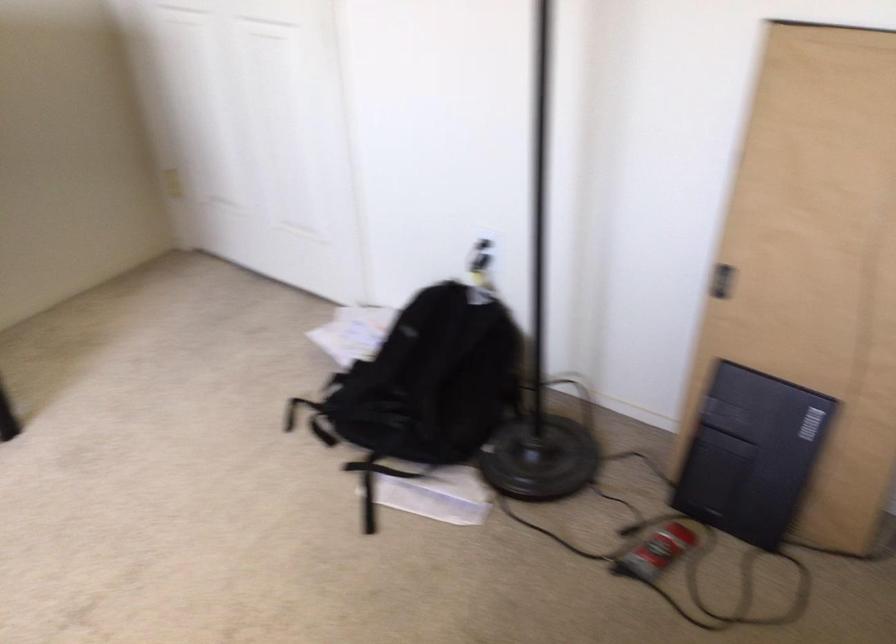
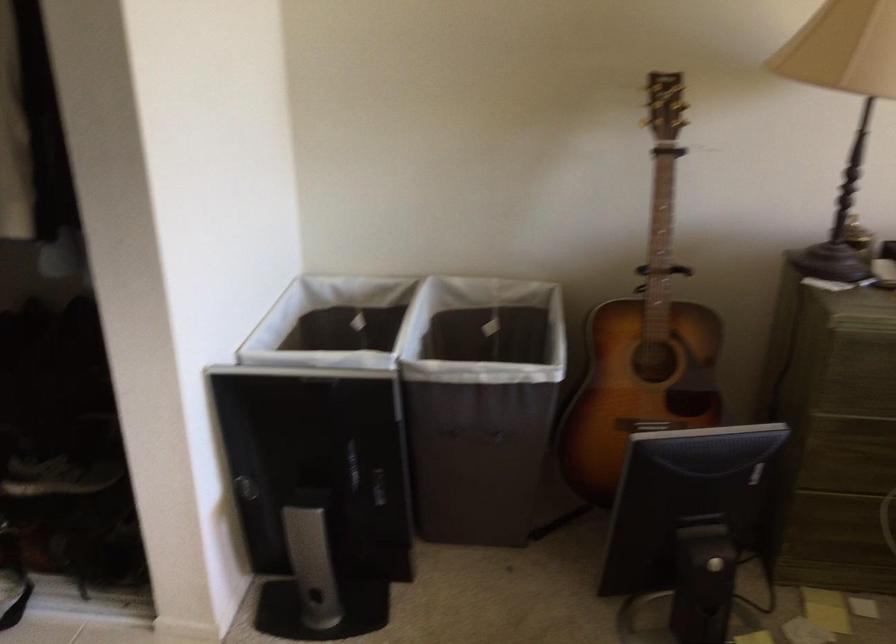
The first image is from the beginning of the video and the second image is from the end. How did the camera likely rotate when shooting the video?

The camera rotated toward right-down.